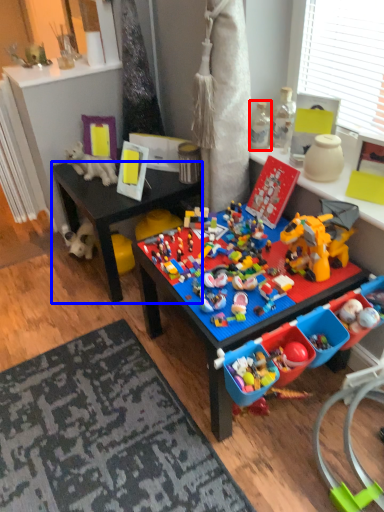
Question: Which point is further to the camera, toy (highlighted by a red box) or desk (highlighted by a blue box)?

Choices:
 (A) toy
 (B) desk

Answer: (B)